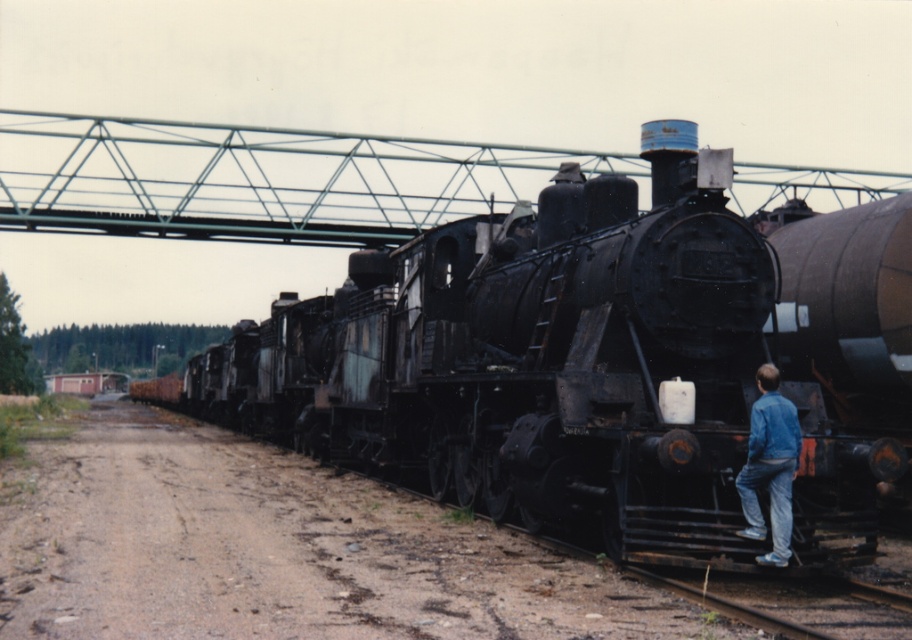
Based on the photo, who is positioned more to the right, rusty metal train at center or blue denim jacket at lower right?

From the viewer's perspective, blue denim jacket at lower right appears more on the right side.

How distant is rusty metal train at center from blue denim jacket at lower right?

The distance of rusty metal train at center from blue denim jacket at lower right is 10.34 meters.

Where is `rusty metal train at center`? The image size is (912, 640). rusty metal train at center is located at coordinates (592, 360).